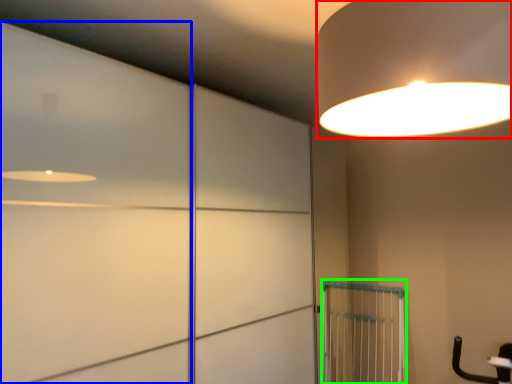
Question: Which is farther away from lamp (highlighted by a red box)? door (highlighted by a blue box) or cage (highlighted by a green box)?

Choices:
 (A) door
 (B) cage

Answer: (B)